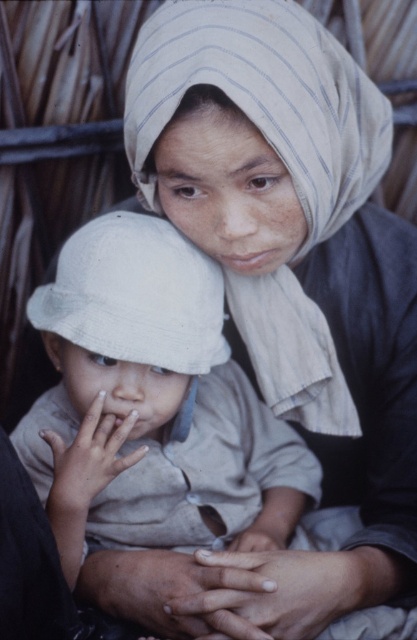
You are a photographer adjusting your camera to focus on two specific points in the image. The first point is at coordinates point (118, 256) and the second is at point (171, 336). Which point should you focus on first if you want to capture the closest object to the camera?

Point (118, 256) is closer to the viewer than point (171, 336), so you should focus on point (118, 256) first to capture the closest object.

You are a tailor trying to decide which hat to place on a mannequin head that is 15 cm in diameter. The mannequin head can only fit one hat. Which hat from the image would you choose between the white cotton hat at center and the white fabric hat at center?

The white cotton hat at center is wider than the white fabric hat at center, so the white cotton hat at center would be more suitable for the mannequin head since it can accommodate the wider hat.